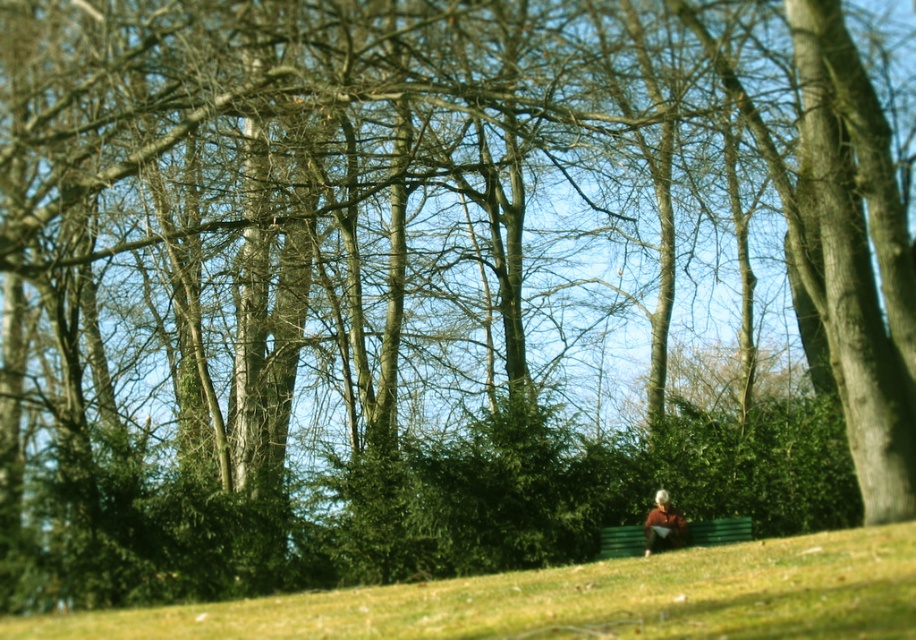
Is green grassy hillside at lower center bigger than green wooden bench at lower center?

Indeed, green grassy hillside at lower center has a larger size compared to green wooden bench at lower center.

In the scene shown: Does green grassy hillside at lower center appear under green wooden bench at lower center?

Actually, green grassy hillside at lower center is above green wooden bench at lower center.

Which is in front, point (892, 616) or point (704, 529)?

Positioned in front is point (892, 616).

Identify the location of green grassy hillside at lower center. (578, 600).

Does green grassy hillside at lower center appear on the left side of blurred beige jacket at lower right?

Indeed, green grassy hillside at lower center is positioned on the left side of blurred beige jacket at lower right.

Is point (449, 628) farther from viewer compared to point (653, 520)?

That is False.

Find the location of a particular element. green grassy hillside at lower center is located at coordinates (578, 600).

Can you confirm if green wooden bench at lower center is positioned to the left of blurred beige jacket at lower right?

In fact, green wooden bench at lower center is to the right of blurred beige jacket at lower right.

Where is `green wooden bench at lower center`? This screenshot has height=640, width=916. green wooden bench at lower center is located at coordinates (718, 531).